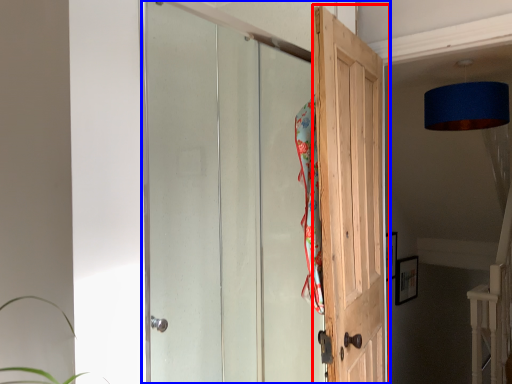
Question: Which object appears closest to the camera in this image, door (highlighted by a red box) or door (highlighted by a blue box)?

Choices:
 (A) door
 (B) door

Answer: (B)